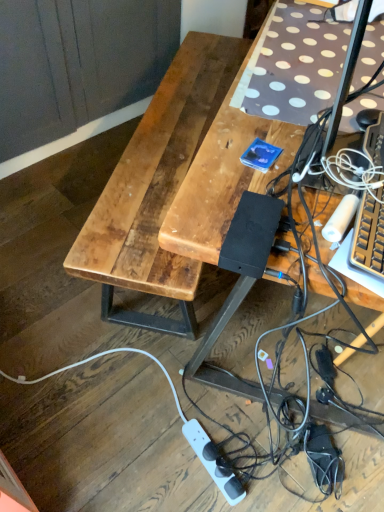
You are a GUI agent. You are given a task and a screenshot of the screen. Output one action in this format:
    pyautogui.click(x=<x>, y=<y>)
    Task: Click on the unoccupied space behind white plastic power strip at lower center
    
    Given the screenshot: What is the action you would take?
    pyautogui.click(x=208, y=400)